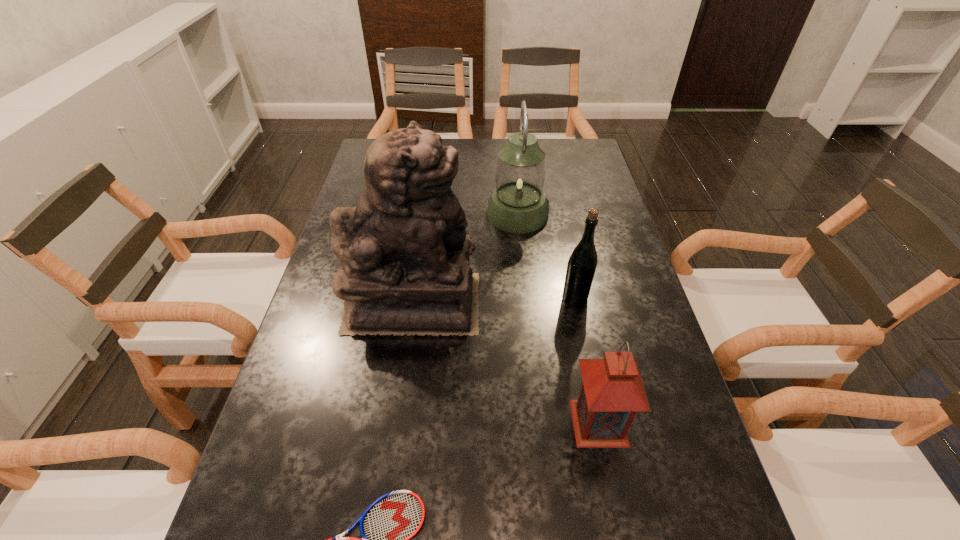
You are a GUI agent. You are given a task and a screenshot of the screen. Output one action in this format:
    pyautogui.click(x=<x>, y=<y>)
    Task: Click on the vacant area between the taller lantern and the beer bottle
    
    Given the screenshot: What is the action you would take?
    pyautogui.click(x=546, y=256)

This screenshot has width=960, height=540. I want to click on vacant area between the farther lantern and the shorter lantern, so click(558, 318).

Identify which object is the fourth closest to the nearest object. Please provide its 2D coordinates. Your answer should be formatted as a tuple, i.e. [(x, y)], where the tuple contains the x and y coordinates of a point satisfying the conditions above.

[(518, 204)]

Select which object is the fourth closest to the shorter lantern. Please provide its 2D coordinates. Your answer should be formatted as a tuple, i.e. [(x, y)], where the tuple contains the x and y coordinates of a point satisfying the conditions above.

[(518, 204)]

At what (x,y) coordinates should I click in order to perform the action: click on vacant point that satisfies the following two spatial constraints: 1. on the front-facing side of the fourth farthest object; 2. on the right side of the tallest object. Please return your answer as a coordinate pair (x, y). The height and width of the screenshot is (540, 960). Looking at the image, I should click on (396, 422).

Where is `free space that satisfies the following two spatial constraints: 1. on the front side of the farther lantern; 2. on the front-facing side of the sculpture`? Image resolution: width=960 pixels, height=540 pixels. free space that satisfies the following two spatial constraints: 1. on the front side of the farther lantern; 2. on the front-facing side of the sculpture is located at coordinates (526, 302).